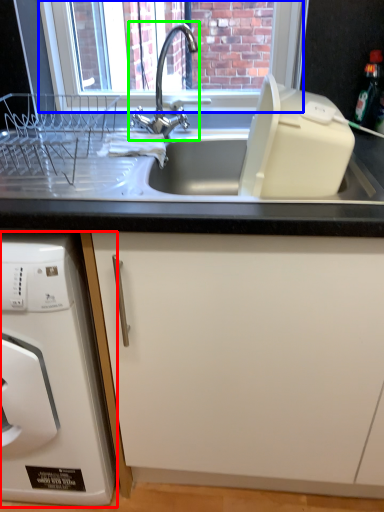
Question: Which object is the farthest from home appliance (highlighted by a red box)? Choose among these: window screen (highlighted by a blue box) or tap (highlighted by a green box).

Choices:
 (A) window screen
 (B) tap

Answer: (A)